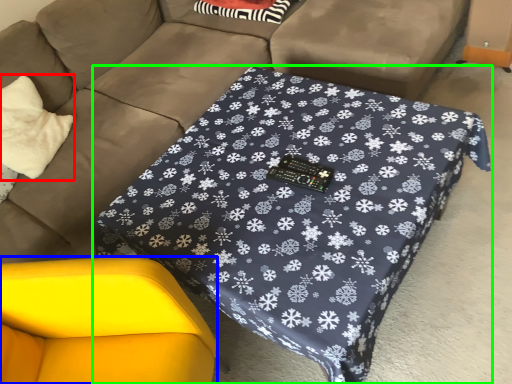
Question: Considering the real-world distances, which object is closest to throw pillow (highlighted by a red box)? swivel chair (highlighted by a blue box) or table (highlighted by a green box).

Choices:
 (A) swivel chair
 (B) table

Answer: (A)